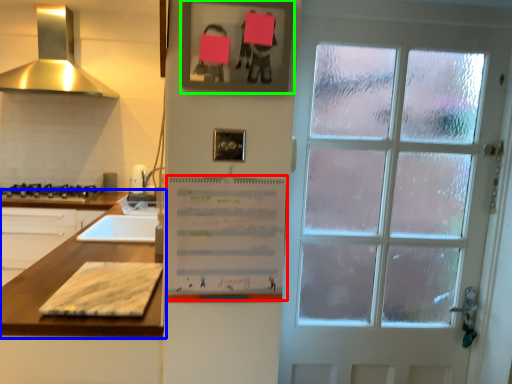
Question: Based on their relative distances, which object is nearer to bulletin board (highlighted by a red box)? Choose from countertop (highlighted by a blue box) and picture frame (highlighted by a green box).

Choices:
 (A) countertop
 (B) picture frame

Answer: (A)